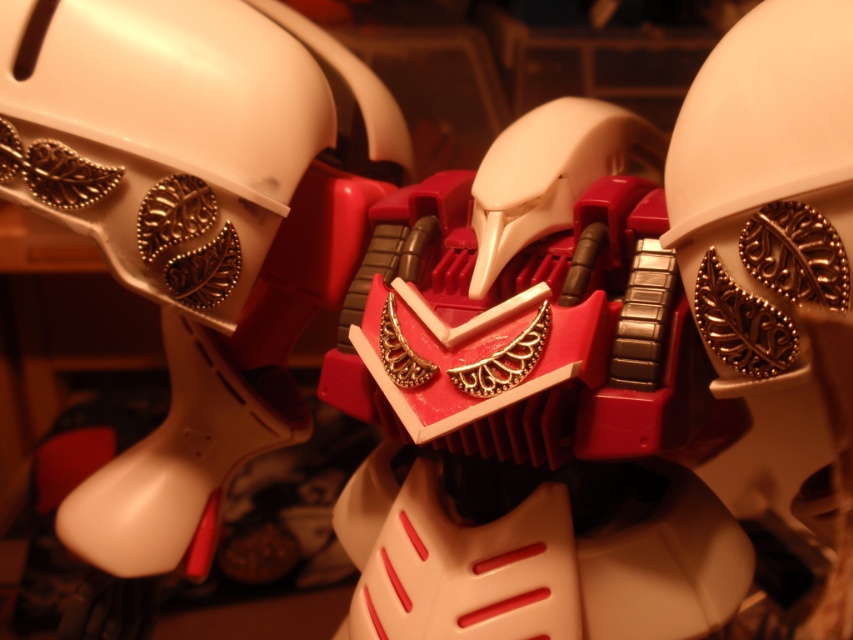
Which is more to the right, matte red plastic robot at center or white matte helmet at upper center?

A: matte red plastic robot at center is more to the right.

Can you confirm if matte red plastic robot at center is positioned below white matte helmet at upper center?

Yes.

You are a GUI agent. You are given a task and a screenshot of the screen. Output one action in this format:
    pyautogui.click(x=<x>, y=<y>)
    Task: Click on the matte red plastic robot at center
    The width and height of the screenshot is (853, 640).
    Given the screenshot: What is the action you would take?
    pyautogui.click(x=593, y=348)

Find the location of a particular element. This screenshot has width=853, height=640. matte red plastic robot at center is located at coordinates (593, 348).

Does matte red plastic robot at center have a smaller size compared to white matte helmet at upper right?

No.

Is matte red plastic robot at center closer to the viewer compared to white matte helmet at upper right?

Yes.

Is point (514, 410) more distant than point (715, 348)?

Yes.

This screenshot has height=640, width=853. What are the coordinates of `matte red plastic robot at center` in the screenshot? It's located at (593, 348).

Can you confirm if white matte helmet at upper center is taller than white matte helmet at upper right?

Yes.

Between white matte helmet at upper center and white matte helmet at upper right, which one appears on the left side from the viewer's perspective?

white matte helmet at upper center is more to the left.

Who is more forward, (119, 118) or (746, 268)?

Point (746, 268) is in front.

Locate an element on the screen. white matte helmet at upper center is located at coordinates (173, 132).